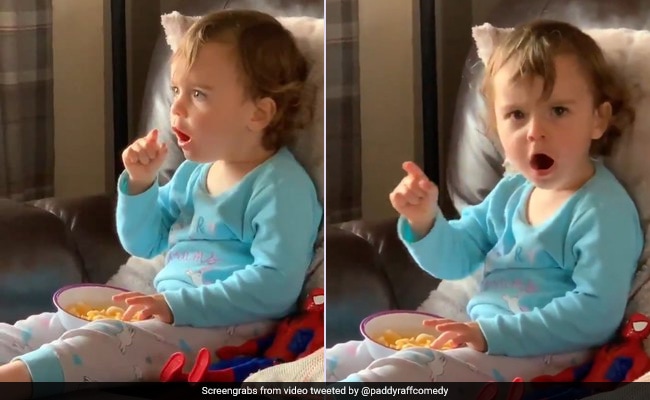
Locate an element on the screen. The width and height of the screenshot is (650, 400). pillow is located at coordinates (634, 59), (306, 34).